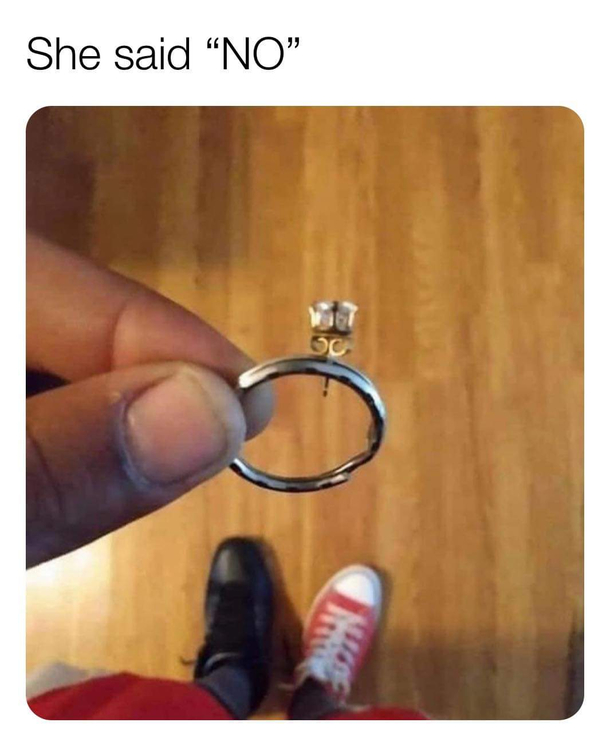
Locate an element on the screen. floor is located at coordinates (465, 548).